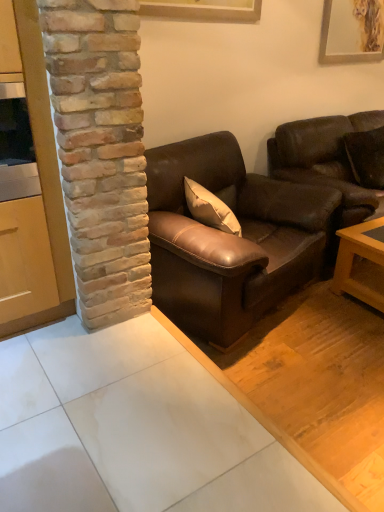
Question: From a real-world perspective, is wooden cabinet at left positioned above or below wooden picture frame at upper center, which ranks as the first picture frame in left-to-right order?

Choices:
 (A) below
 (B) above

Answer: (A)

Question: From the image's perspective, relative to wooden picture frame at upper center, which ranks as the first picture frame in left-to-right order, is wooden cabinet at left above or below?

Choices:
 (A) below
 (B) above

Answer: (A)

Question: Which object is positioned closest to the brown leather couch at right, marked as the first studio couch in a right-to-left arrangement?

Choices:
 (A) wooden picture frame at upper center, which is the 1th picture frame from front to back
 (B) matte gold picture frame at upper right, the second picture frame in the front-to-back sequence
 (C) brown leather couch at center, the first studio couch from the left
 (D) brown leather pillow at upper right
 (E) wooden cabinet at left

Answer: (D)

Question: Estimate the real-world distances between objects in this image. Which object is farther from the matte gold picture frame at upper right, the second picture frame in the front-to-back sequence?

Choices:
 (A) wooden picture frame at upper center, positioned as the 2th picture frame in right-to-left order
 (B) brown leather couch at center, the first studio couch from the left
 (C) wooden cabinet at left
 (D) brown leather couch at right, marked as the first studio couch in a right-to-left arrangement
 (E) brown leather pillow at upper right

Answer: (C)